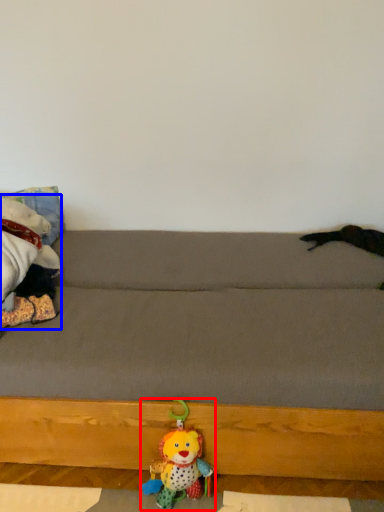
Question: Which point is further to the camera, toy (highlighted by a red box) or toy (highlighted by a blue box)?

Choices:
 (A) toy
 (B) toy

Answer: (B)